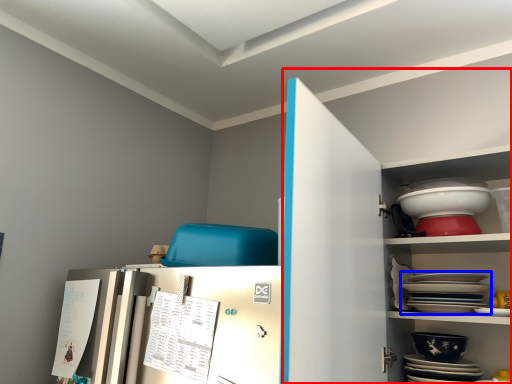
Question: Which of the following is the closest to the observer, dresser (highlighted by a red box) or platter (highlighted by a blue box)?

Choices:
 (A) dresser
 (B) platter

Answer: (A)